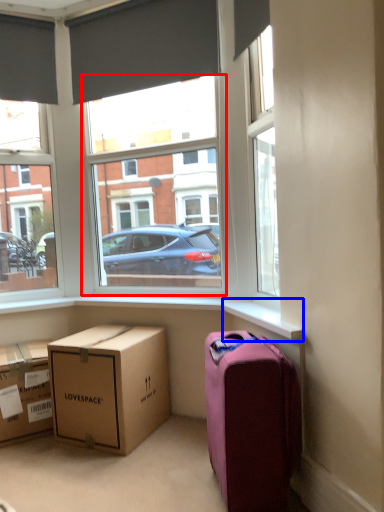
Question: Which point is further to the camera, window frame (highlighted by a red box) or window sill (highlighted by a blue box)?

Choices:
 (A) window frame
 (B) window sill

Answer: (A)